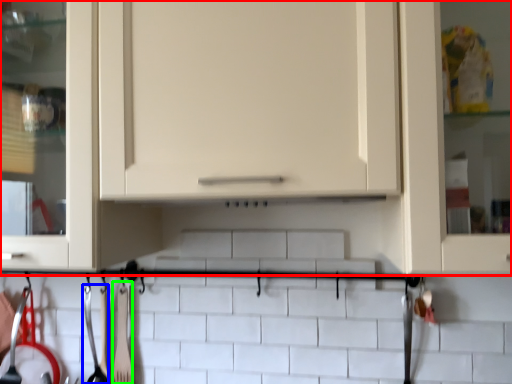
Question: Which is nearer to the cabinetry (highlighted by a red box)? silverware (highlighted by a blue box) or silverware (highlighted by a green box).

Choices:
 (A) silverware
 (B) silverware

Answer: (B)